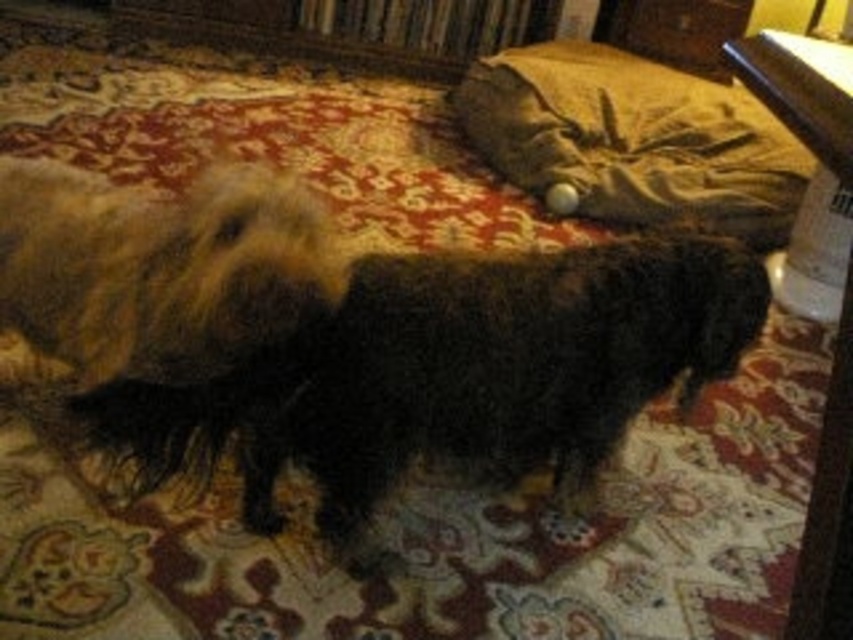
Looking at this image, you are a photographer trying to capture the perfect shot of the fuzzy black dog at center and the fuzzy brown fur at center. If you want to ensure both subjects are in focus, how far apart are they from each other?

The fuzzy black dog at center is 11.57 inches away from the fuzzy brown fur at center, so you need to adjust your camera settings to account for this distance to ensure both are in focus.

You are standing in the room and want to place a small 1.5 feet tall statue exactly at the point marked as point (x=294, y=413). Based on the scene description, will the statue be visible to someone sitting on the bed with the yellowish brown comforter?

The point (x=294, y=413) is 4.79 feet away from the viewer. Since the statue is only 1.5 feet tall, it may not be visible from that distance unless the viewer has a clear line of sight and good eyesight. However, the scene description mentions the dog is mid movement with blurred body, but does not mention any obstructions at that point. Therefore, it depends on the exact placement and line of sight.